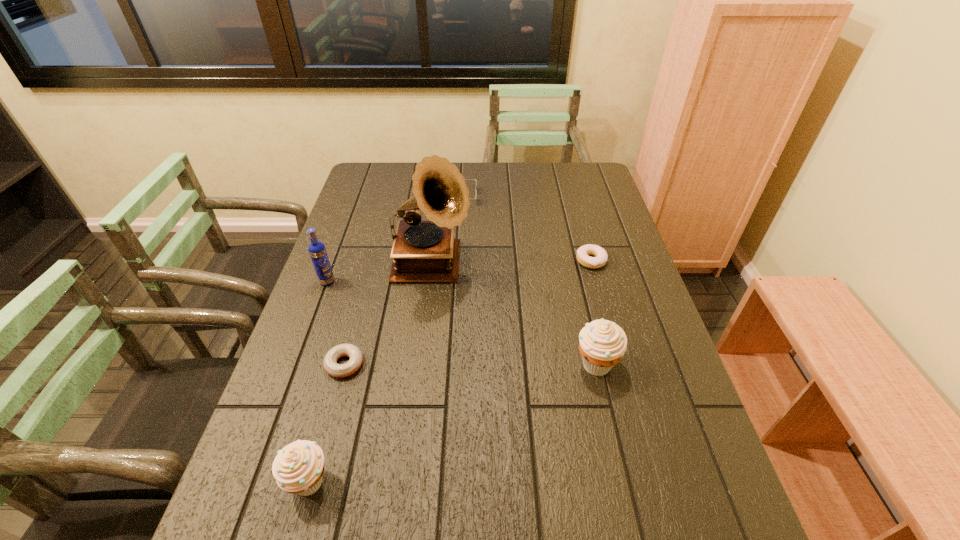
Identify the location of vodka at the left edge. (317, 251).

In order to click on doughnut that is at the left edge in this screenshot , I will do `click(330, 364)`.

Image resolution: width=960 pixels, height=540 pixels. Find the location of `muffin at the right edge`. muffin at the right edge is located at coordinates (602, 344).

Locate an element on the screen. The width and height of the screenshot is (960, 540). doughnut at the right edge is located at coordinates (600, 259).

This screenshot has height=540, width=960. I want to click on object at the near left corner, so click(298, 468).

Locate an element on the screen. This screenshot has width=960, height=540. vacant region at the far edge of the desktop is located at coordinates [409, 163].

In the image, there is a desktop. At what (x,y) coordinates should I click in order to perform the action: click on vacant space at the left edge. Please return your answer as a coordinate pair (x, y). Looking at the image, I should click on (333, 240).

The width and height of the screenshot is (960, 540). In order to click on free space at the right edge in this screenshot , I will do (x=653, y=316).

Where is `vacant space at the far left corner of the desktop`? vacant space at the far left corner of the desktop is located at coordinates (390, 164).

Locate an element on the screen. This screenshot has width=960, height=540. free location at the far right corner of the desktop is located at coordinates (600, 185).